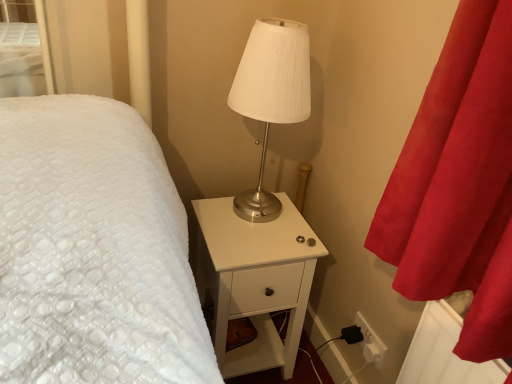
Question: From the image's perspective, is satin white lamp at center on top of white glossy nightstand at center?

Choices:
 (A) no
 (B) yes

Answer: (B)

Question: Considering the relative positions of satin white lamp at center and white glossy nightstand at center in the image provided, is satin white lamp at center to the right of white glossy nightstand at center from the viewer's perspective?

Choices:
 (A) no
 (B) yes

Answer: (B)

Question: Does satin white lamp at center have a smaller size compared to white glossy nightstand at center?

Choices:
 (A) yes
 (B) no

Answer: (A)

Question: Are satin white lamp at center and white glossy nightstand at center far apart?

Choices:
 (A) no
 (B) yes

Answer: (A)

Question: From a real-world perspective, is satin white lamp at center located beneath white glossy nightstand at center?

Choices:
 (A) yes
 (B) no

Answer: (B)

Question: Is satin white lamp at center further to the viewer compared to white glossy nightstand at center?

Choices:
 (A) no
 (B) yes

Answer: (A)

Question: Does white glossy nightstand at center appear on the left side of satin white lamp at center?

Choices:
 (A) no
 (B) yes

Answer: (B)

Question: From a real-world perspective, is white glossy nightstand at center located higher than satin white lamp at center?

Choices:
 (A) yes
 (B) no

Answer: (B)

Question: From a real-world perspective, is white glossy nightstand at center under satin white lamp at center?

Choices:
 (A) yes
 (B) no

Answer: (A)

Question: Is satin white lamp at center at the back of white glossy nightstand at center?

Choices:
 (A) yes
 (B) no

Answer: (B)

Question: From the image's perspective, is white glossy nightstand at center under satin white lamp at center?

Choices:
 (A) yes
 (B) no

Answer: (A)

Question: Is white glossy nightstand at center to the right of satin white lamp at center from the viewer's perspective?

Choices:
 (A) yes
 (B) no

Answer: (B)

Question: From the image's perspective, relative to satin white lamp at center, is white glossy nightstand at center above or below?

Choices:
 (A) below
 (B) above

Answer: (A)